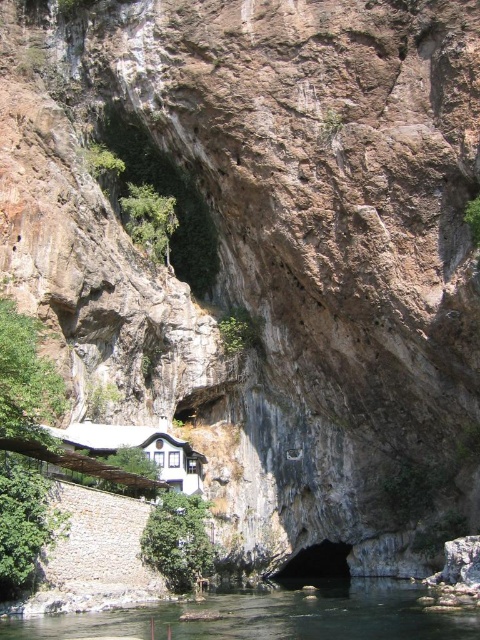
You are a hiker who wants to cross from the cliff to the building. You see clear water at lower center and a black rock cave at center. Which path would allow you to carry more gear without it getting submerged?

The clear water at lower center is bigger than the black rock cave at center, so the clear water at lower center would allow you to carry more gear without it getting submerged because it has a larger capacity.